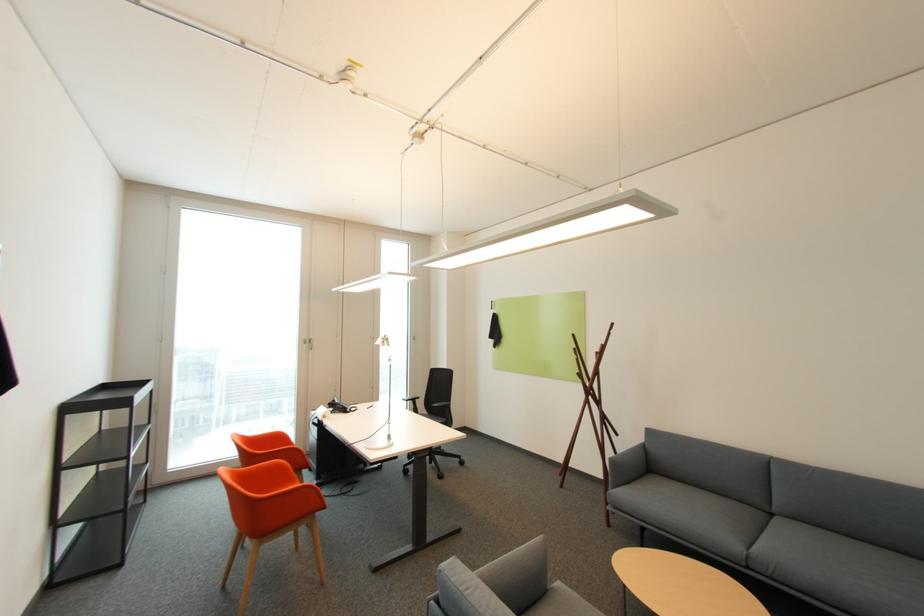
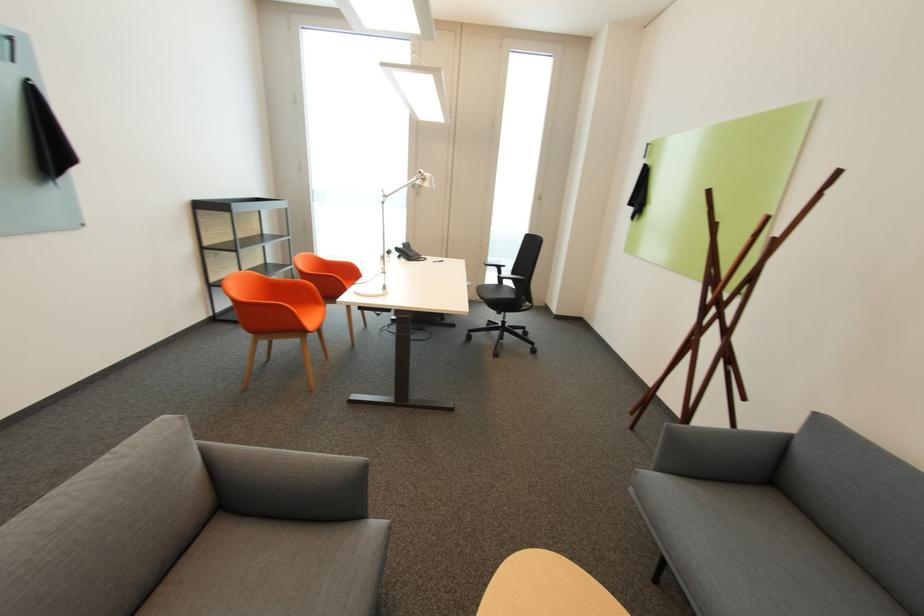
Find the pixel in the second image that matches [566,476] in the first image.

(638, 414)